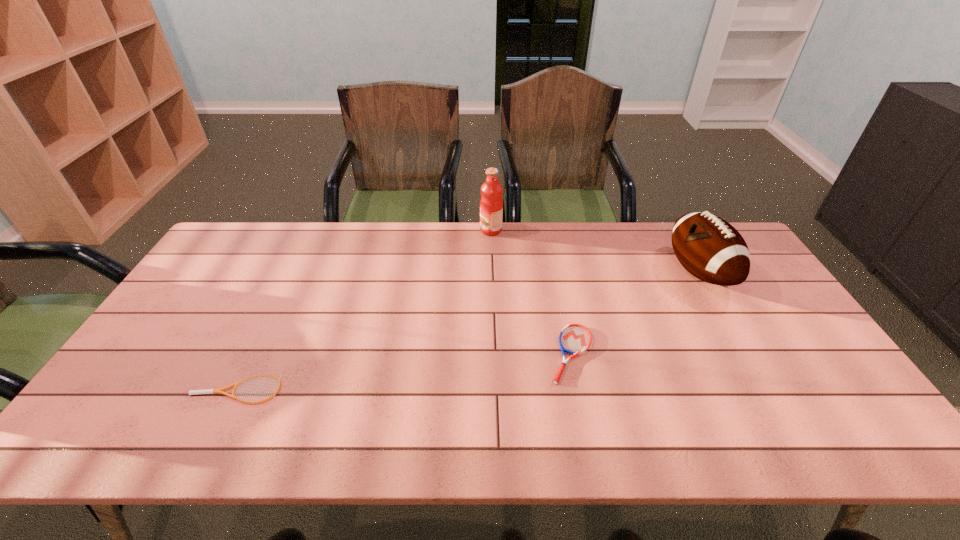
Find the location of a particular element. free spot located on the front of the right tennis racket is located at coordinates (586, 422).

What are the coordinates of `free space located on the back of the leftmost object` in the screenshot? It's located at 280,301.

Locate an element on the screen. The width and height of the screenshot is (960, 540). fruit juice located in the far edge section of the desktop is located at coordinates (491, 203).

Image resolution: width=960 pixels, height=540 pixels. I want to click on football (American) positioned at the far edge, so [712, 250].

This screenshot has height=540, width=960. Identify the location of object situated at the right edge. (712, 250).

Identify the location of object that is at the far right corner. (712, 250).

Find the location of a particular element. Image resolution: width=960 pixels, height=540 pixels. vacant region at the far edge of the desktop is located at coordinates (318, 233).

Find the location of a particular element. This screenshot has height=540, width=960. free space at the near edge of the desktop is located at coordinates (485, 432).

Image resolution: width=960 pixels, height=540 pixels. In the image, there is a desktop. What are the coordinates of `vacant space at the left edge` in the screenshot? It's located at (200, 276).

In the image, there is a desktop. Where is `vacant space at the right edge`? vacant space at the right edge is located at coordinates (806, 349).